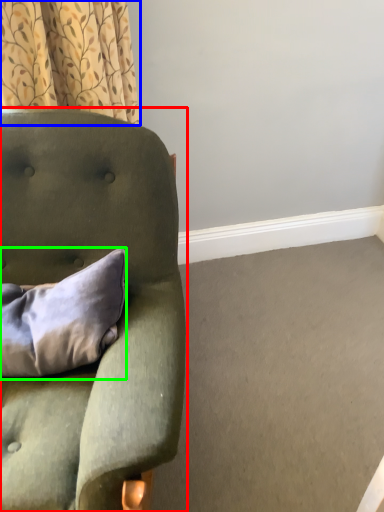
Question: Which object is the farthest from chair (highlighted by a red box)? Choose among these: curtain (highlighted by a blue box) or pillow (highlighted by a green box).

Choices:
 (A) curtain
 (B) pillow

Answer: (A)